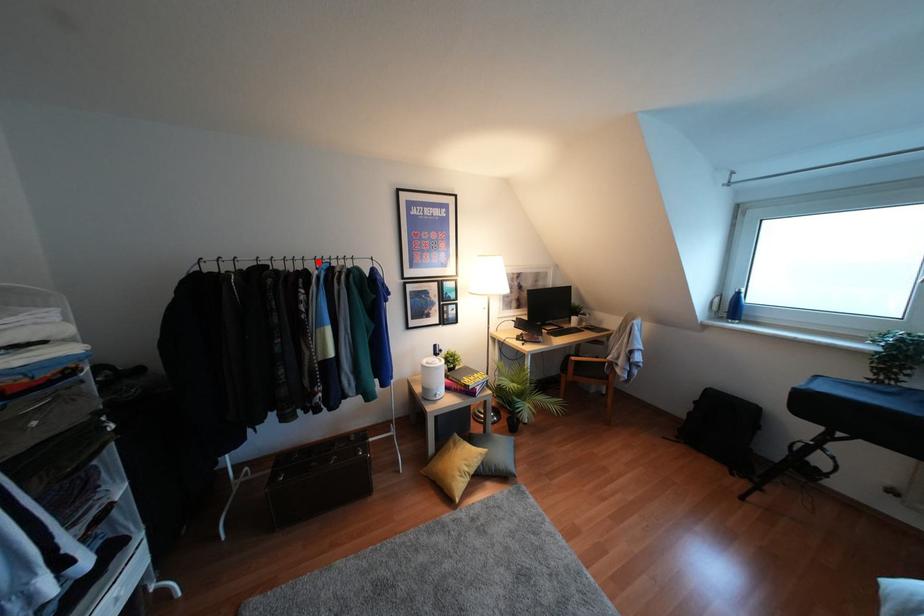
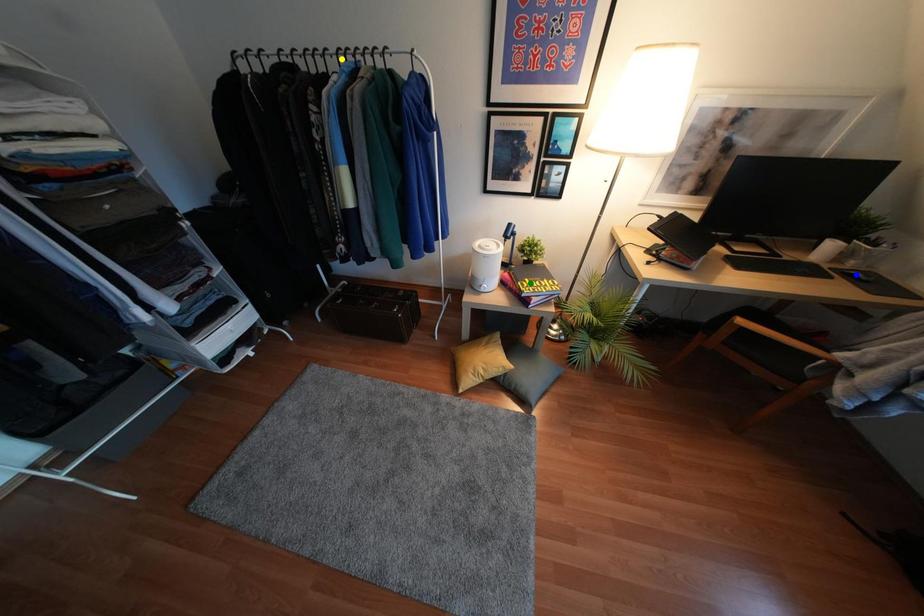
Question: I am providing you with two images of the same scene from different viewpoints. A red point is marked on the first image. You are given multiple points on the second image. Which point in image 2 is actually the same real-world point as the red point in image 1?

Choices:
 (A) green point
 (B) yellow point
 (C) blue point

Answer: (B)